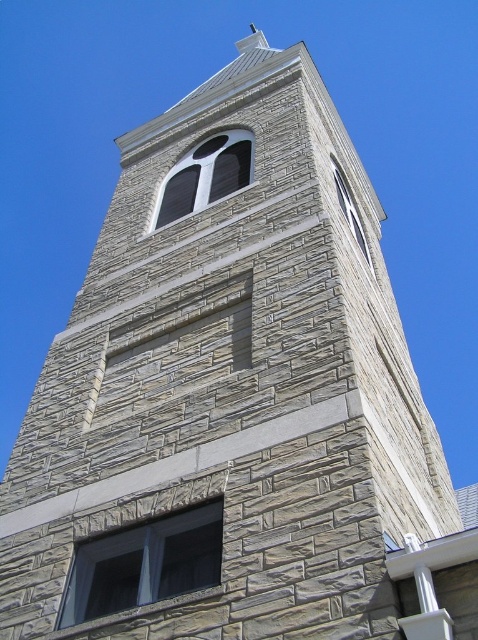
Who is higher up, matte gray stone window at center or smooth stone window at upper center?

Positioned higher is smooth stone window at upper center.

Who is more distant from viewer, (86,545) or (359,246)?

Point (359,246)

Which is behind, point (175, 529) or point (357, 221)?

Point (357, 221)

Identify the location of matte gray stone window at center. The width and height of the screenshot is (478, 640). (144, 563).

Who is taller, matte glass window at center or smooth stone window at upper center?

With more height is smooth stone window at upper center.

Which is behind, point (177, 177) or point (358, 227)?

The point (358, 227) is behind.

The image size is (478, 640). I want to click on matte glass window at center, so click(205, 176).

Is matte gray stone window at center closer to the viewer compared to matte glass window at center?

Yes, it is in front of matte glass window at center.

Who is taller, matte gray stone window at center or matte glass window at center?

Standing taller between the two is matte glass window at center.

Describe the element at coordinates (144, 563) in the screenshot. I see `matte gray stone window at center` at that location.

The width and height of the screenshot is (478, 640). Identify the location of matte gray stone window at center. (144, 563).